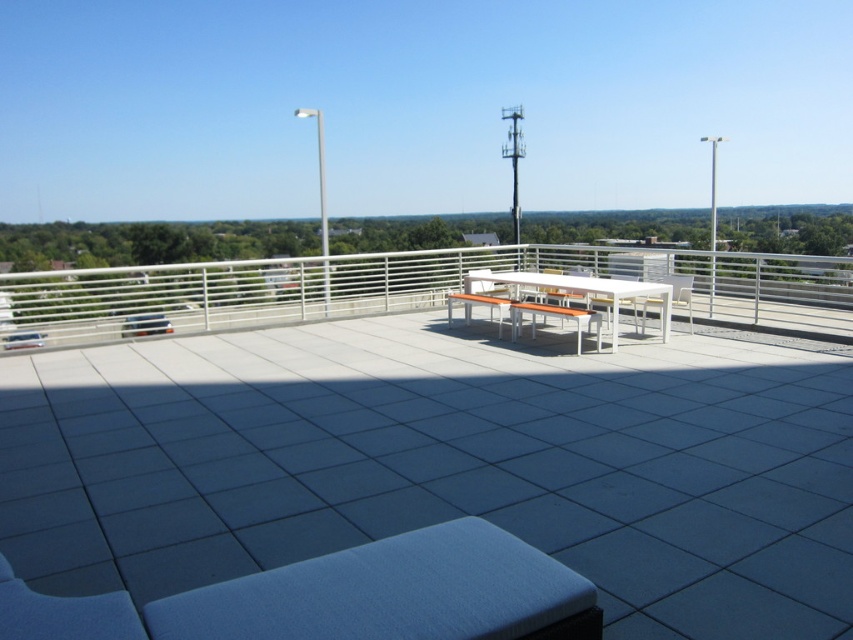
Question: Which of the following is the closest to the observer?

Choices:
 (A) (674, 304)
 (B) (569, 289)

Answer: (B)

Question: Which point is farther to the camera?

Choices:
 (A) (659, 307)
 (B) (575, 252)
 (C) (515, 275)
 (D) (346, 449)

Answer: (B)

Question: Observing the image, what is the correct spatial positioning of white matte picnic table at center in reference to white plastic chair at center?

Choices:
 (A) left
 (B) right

Answer: (A)

Question: Which point is closer to the camera?

Choices:
 (A) (606, 579)
 (B) (670, 276)
 (C) (596, 282)

Answer: (A)

Question: Can you confirm if white tile deck at center is bigger than white metal railing at upper center?

Choices:
 (A) no
 (B) yes

Answer: (B)

Question: Is white tile deck at center smaller than white plastic chair at center?

Choices:
 (A) no
 (B) yes

Answer: (A)